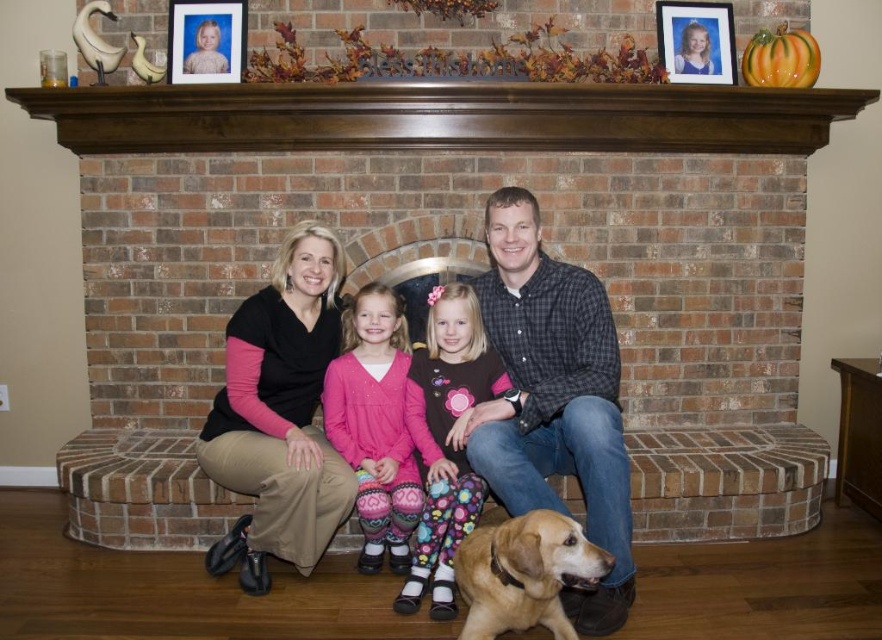
You are standing in the living room facing the fireplace mantel. There are two points marked on the mantel at coordinates point [629,132] and point [722,22]. If you want to place a small candle between them so it is closer to the point that is further away from you, where should you place it?

The point at [629,132] is in front of the point at [722,22], meaning the latter is further away. To place the candle closer to the point that is further away, position it nearer to point [722,22].

You are a photographer trying to capture a photo of the checkered shirt at center and the matte plastic picture frame at upper right. Which object is wider from your current viewpoint?

The checkered shirt at center might be wider than matte plastic picture frame at upper right.

You are a photographer taking a picture of the checkered shirt at center and the matte plastic picture frame at upper right. Which object is positioned to the left of the other?

The checkered shirt at center is positioned to the left of the matte plastic picture frame at upper right.